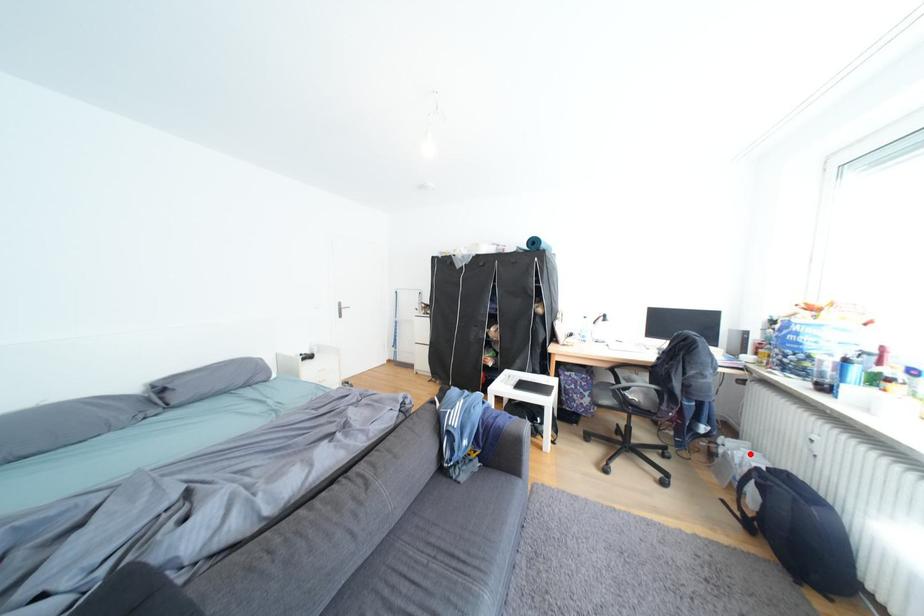
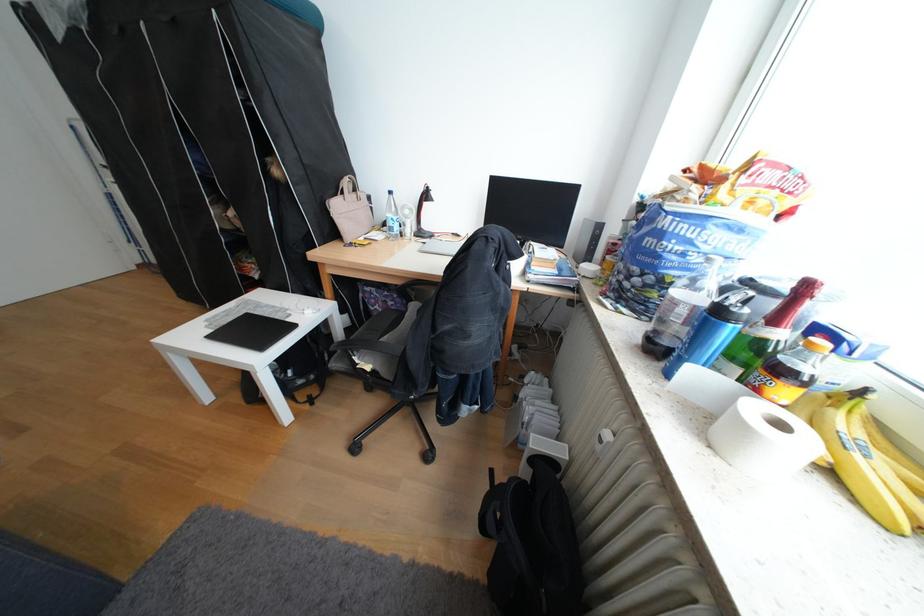
Locate, in the second image, the point that corresponds to the highlighted location in the first image.

(541, 410)